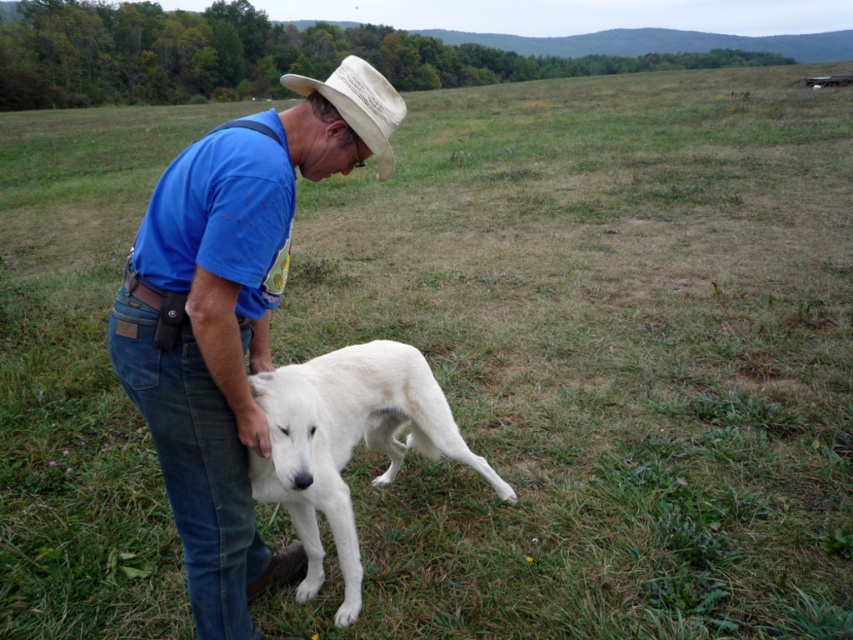
Question: Considering the real-world distances, which object is farthest from the beige fabric cowboy hat at center?

Choices:
 (A) blue cotton shirt at center
 (B) white fur dog at lower left

Answer: (B)

Question: Which object is farther from the camera taking this photo?

Choices:
 (A) blue cotton shirt at center
 (B) white fur dog at lower left

Answer: (B)

Question: From the image, what is the correct spatial relationship of blue cotton shirt at center in relation to white fur dog at lower left?

Choices:
 (A) right
 (B) left

Answer: (B)

Question: Does blue cotton shirt at center appear under white fur dog at lower left?

Choices:
 (A) yes
 (B) no

Answer: (B)

Question: Can you confirm if blue cotton shirt at center is positioned above white fur dog at lower left?

Choices:
 (A) no
 (B) yes

Answer: (B)

Question: Which point is farther from the camera taking this photo?

Choices:
 (A) (350, 356)
 (B) (268, 214)
 (C) (381, 80)

Answer: (A)